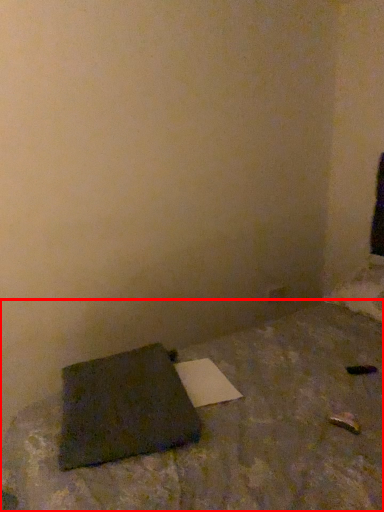
Question: From the image's perspective, where is furniture (annotated by the red box) located relative to notebook?

Choices:
 (A) below
 (B) above

Answer: (B)